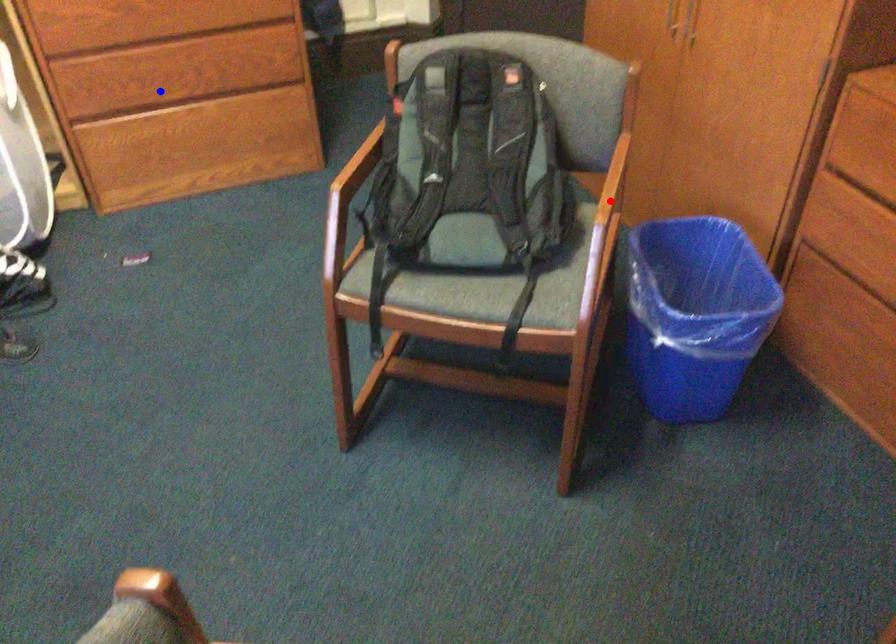
Question: Which of the two points in the image is closer to the camera?

Choices:
 (A) Blue point is closer.
 (B) Red point is closer.

Answer: (B)